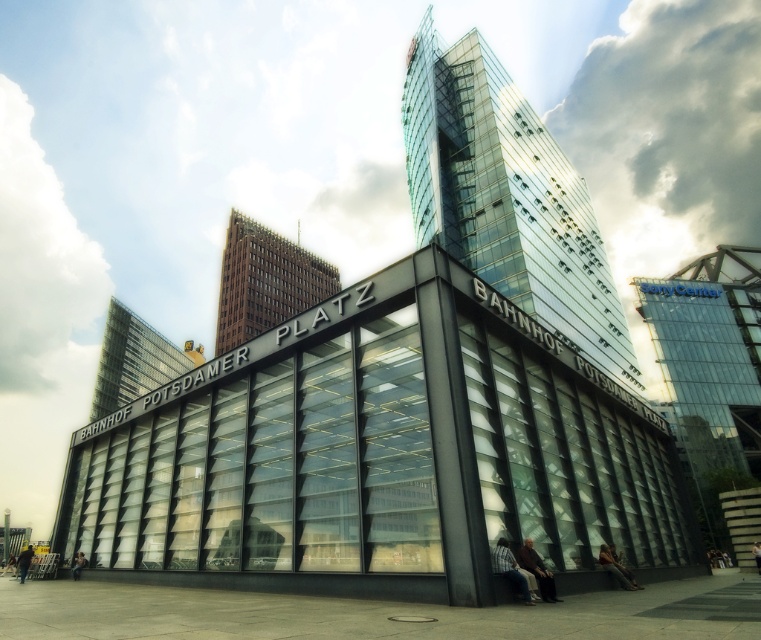
You are standing at the entrance of the BAHNHOF POTSDAMER PLATZ and want to find the blue denim jeans at lower center. According to the image, where exactly should you look?

The blue denim jeans at lower center is located at point [508,568], so you should look towards the lower central area of the image where those coordinates are marked.